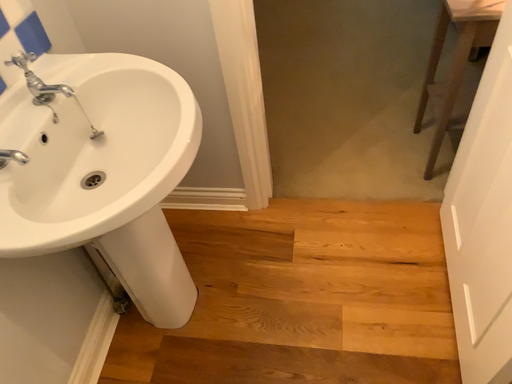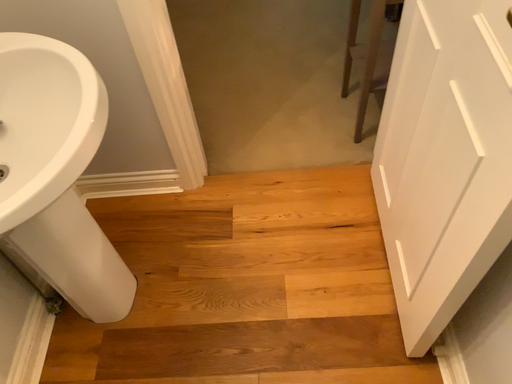
Question: How did the camera likely rotate when shooting the video?

Choices:
 (A) rotated left
 (B) rotated right

Answer: (B)